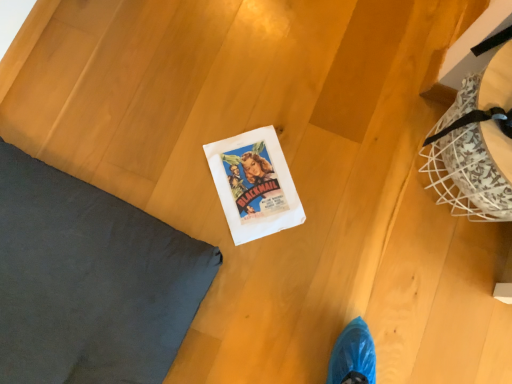
What do you see at coordinates (254, 184) in the screenshot? I see `white paper comic book at center` at bounding box center [254, 184].

You are a GUI agent. You are given a task and a screenshot of the screen. Output one action in this format:
    pyautogui.click(x=<x>, y=<y>)
    Task: Click on the white paper comic book at center
    This screenshot has width=512, height=384.
    Given the screenshot: What is the action you would take?
    pyautogui.click(x=254, y=184)

Where is `dark gray fabric pillow at upper left`? Image resolution: width=512 pixels, height=384 pixels. dark gray fabric pillow at upper left is located at coordinates (90, 281).

The image size is (512, 384). What do you see at coordinates (90, 281) in the screenshot? I see `dark gray fabric pillow at upper left` at bounding box center [90, 281].

I want to click on white paper comic book at center, so click(254, 184).

Which is more to the left, white paper comic book at center or dark gray fabric pillow at upper left?

From the viewer's perspective, dark gray fabric pillow at upper left appears more on the left side.

Is the depth of white paper comic book at center greater than that of dark gray fabric pillow at upper left?

Yes, it is behind dark gray fabric pillow at upper left.

Considering the positions of point (245, 231) and point (167, 240), is point (245, 231) closer or farther from the camera than point (167, 240)?

Clearly, point (245, 231) is more distant from the camera than point (167, 240).

From the image's perspective, which is below, white paper comic book at center or dark gray fabric pillow at upper left?

dark gray fabric pillow at upper left, from the image's perspective.

From a real-world perspective, does white paper comic book at center sit lower than dark gray fabric pillow at upper left?

Yes, from a real-world perspective, white paper comic book at center is below dark gray fabric pillow at upper left.

Considering the sizes of objects white paper comic book at center and dark gray fabric pillow at upper left in the image provided, who is thinner, white paper comic book at center or dark gray fabric pillow at upper left?

Thinner between the two is white paper comic book at center.

Considering the sizes of white paper comic book at center and dark gray fabric pillow at upper left in the image, is white paper comic book at center taller or shorter than dark gray fabric pillow at upper left?

In the image, white paper comic book at center appears to be shorter than dark gray fabric pillow at upper left.

Does white paper comic book at center have a larger size compared to dark gray fabric pillow at upper left?

Incorrect, white paper comic book at center is not larger than dark gray fabric pillow at upper left.

Is white paper comic book at center situated inside dark gray fabric pillow at upper left or outside?

white paper comic book at center exists outside the volume of dark gray fabric pillow at upper left.

Is white paper comic book at center not close to dark gray fabric pillow at upper left?

white paper comic book at center is actually quite close to dark gray fabric pillow at upper left.

Is white paper comic book at center oriented towards dark gray fabric pillow at upper left?

No, white paper comic book at center is not turned towards dark gray fabric pillow at upper left.

What's the angular difference between white paper comic book at center and dark gray fabric pillow at upper left's facing directions?

There is a 14.4-degree angle between the facing directions of white paper comic book at center and dark gray fabric pillow at upper left.

The image size is (512, 384). I want to click on pillow on the left of white paper comic book at center, so click(90, 281).

Based on the photo, is dark gray fabric pillow at upper left at the right side of white paper comic book at center?

In fact, dark gray fabric pillow at upper left is to the left of white paper comic book at center.

Which is in front, dark gray fabric pillow at upper left or white paper comic book at center?

dark gray fabric pillow at upper left is closer to the camera.

Is point (155, 346) behind point (225, 203)?

No, (155, 346) is in front of (225, 203).

From the image's perspective, is dark gray fabric pillow at upper left located above or below white paper comic book at center?

Based on their image positions, dark gray fabric pillow at upper left is located beneath white paper comic book at center.

From a real-world perspective, is dark gray fabric pillow at upper left positioned above or below white paper comic book at center?

From a real-world perspective, dark gray fabric pillow at upper left is physically above white paper comic book at center.

Considering the relative sizes of dark gray fabric pillow at upper left and white paper comic book at center in the image provided, is dark gray fabric pillow at upper left thinner than white paper comic book at center?

No.

Which of these two, dark gray fabric pillow at upper left or white paper comic book at center, stands shorter?

white paper comic book at center is shorter.

Is dark gray fabric pillow at upper left bigger than white paper comic book at center?

Correct, dark gray fabric pillow at upper left is larger in size than white paper comic book at center.

Is dark gray fabric pillow at upper left positioned beyond the bounds of white paper comic book at center?

Absolutely, dark gray fabric pillow at upper left is external to white paper comic book at center.

Is dark gray fabric pillow at upper left directly adjacent to white paper comic book at center?

No, dark gray fabric pillow at upper left is not next to white paper comic book at center.

Is dark gray fabric pillow at upper left positioned with its back to white paper comic book at center?

No, dark gray fabric pillow at upper left is not facing the opposite direction of white paper comic book at center.

Can you tell me how much dark gray fabric pillow at upper left and white paper comic book at center differ in facing direction?

The facing directions of dark gray fabric pillow at upper left and white paper comic book at center are 14.4 degrees apart.

Locate an element on the screen. pillow that appears above the white paper comic book at center (from a real-world perspective) is located at coordinates (90, 281).

Where is `comic book that is under the dark gray fabric pillow at upper left (from a real-world perspective)`? comic book that is under the dark gray fabric pillow at upper left (from a real-world perspective) is located at coordinates tap(254, 184).

You are a GUI agent. You are given a task and a screenshot of the screen. Output one action in this format:
    pyautogui.click(x=<x>, y=<y>)
    Task: Click on the pillow lying in front of the white paper comic book at center
    The width and height of the screenshot is (512, 384).
    Given the screenshot: What is the action you would take?
    pyautogui.click(x=90, y=281)